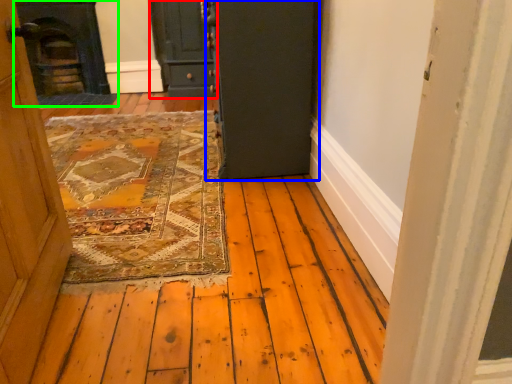
Question: Based on their relative distances, which object is nearer to door (highlighted by a red box)? Choose from door (highlighted by a blue box) and fireplace (highlighted by a green box).

Choices:
 (A) door
 (B) fireplace

Answer: (B)